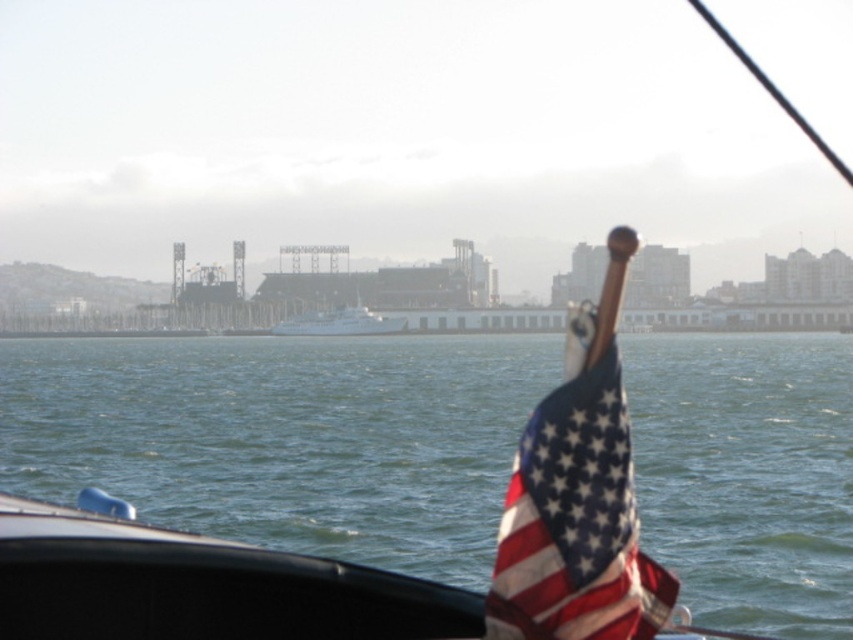
You are on a boat and want to compare the sizes of the american flag at right and the white glossy boat at center. Which one is wider?

The american flag at right has a lesser width compared to white glossy boat at center, so the white glossy boat at center is wider.

You are standing on the boat and want to take a photo of the cityscape in the background. To ensure the green water at lower center is not blocking the view, where should you position your camera relative to the water?

The green water at lower center is located at coordinates (283, 435). To avoid blocking the cityscape, position the camera above or to the side of this point so the water doesn not obscure the background.

You are on a boat and want to determine if the green water at lower center is taller than the american flag at right. Based on the scene, can you confirm this?

The green water at lower center has a greater height compared to the american flag at right, so yes, the green water at lower center is taller than the american flag at right.